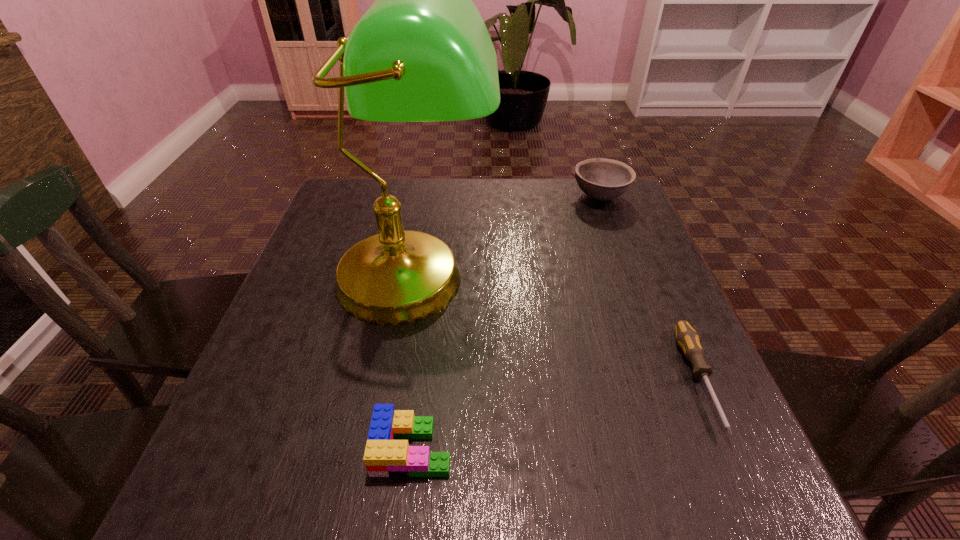
In the image, there is a desktop. Where is `free region at the near right corner`? The height and width of the screenshot is (540, 960). free region at the near right corner is located at coordinates (723, 470).

You are a GUI agent. You are given a task and a screenshot of the screen. Output one action in this format:
    pyautogui.click(x=<x>, y=<y>)
    Task: Click on the unoccupied position between the screwdriver and the third tallest object
    
    Given the screenshot: What is the action you would take?
    pyautogui.click(x=556, y=414)

Locate an element on the screen. The width and height of the screenshot is (960, 540). vacant space that is in between the lamp and the bowl is located at coordinates (507, 238).

Locate an element on the screen. This screenshot has width=960, height=540. vacant area that lies between the screwdriver and the third tallest object is located at coordinates (556, 414).

Find the location of a particular element. The width and height of the screenshot is (960, 540). empty space between the lamp and the shortest object is located at coordinates (557, 329).

Find the location of `empty location between the shortest object and the Lego`. empty location between the shortest object and the Lego is located at coordinates (556, 414).

Locate an element on the screen. vacant space in between the lamp and the Lego is located at coordinates (414, 363).

Image resolution: width=960 pixels, height=540 pixels. I want to click on vacant space in between the farthest object and the lamp, so click(x=507, y=238).

Where is `vacant region between the second shortest object and the screwdriver`? This screenshot has width=960, height=540. vacant region between the second shortest object and the screwdriver is located at coordinates (556, 414).

Where is `vacant area that lies between the third shortest object and the third tallest object`? This screenshot has height=540, width=960. vacant area that lies between the third shortest object and the third tallest object is located at coordinates (506, 322).